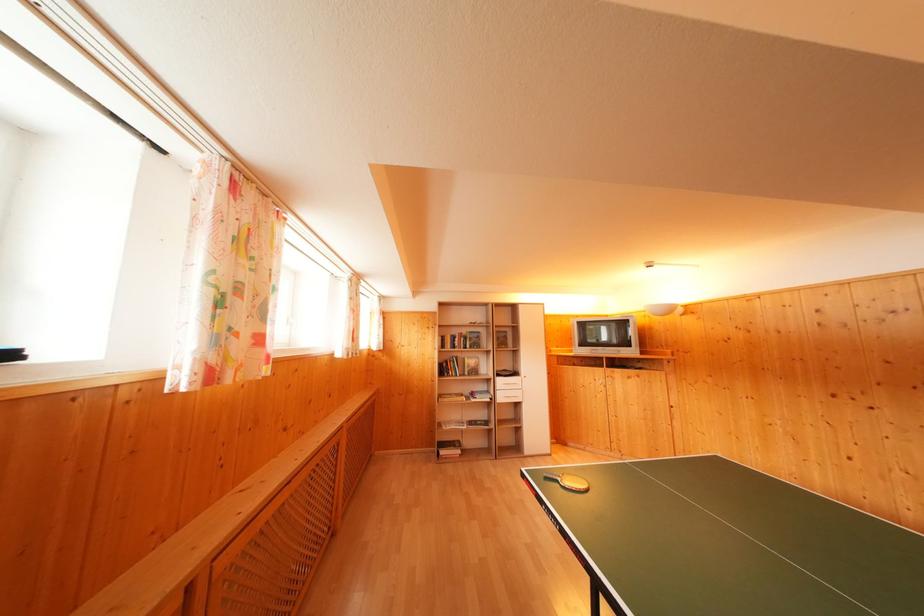
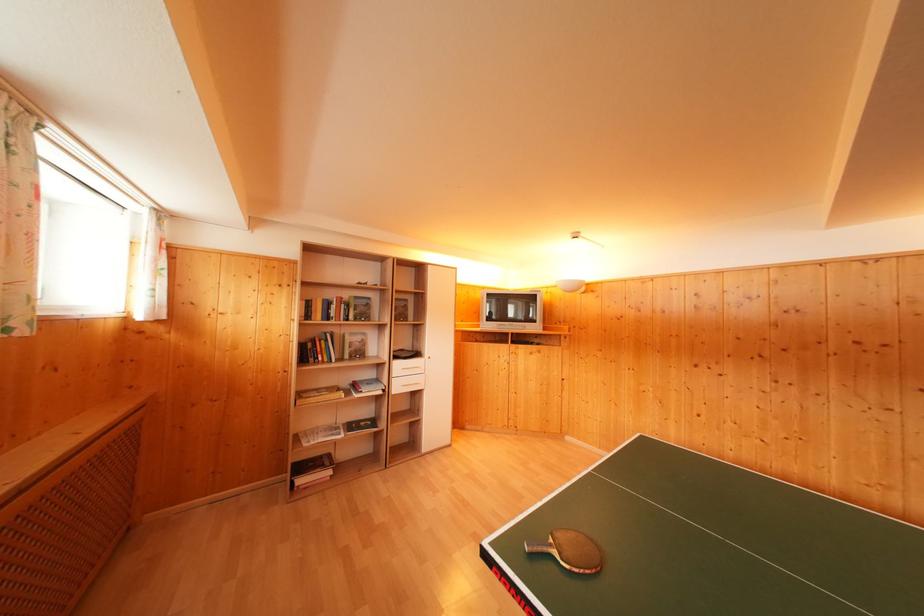
Locate, in the second image, the point that corresponds to (x=565, y=485) in the first image.

(561, 557)